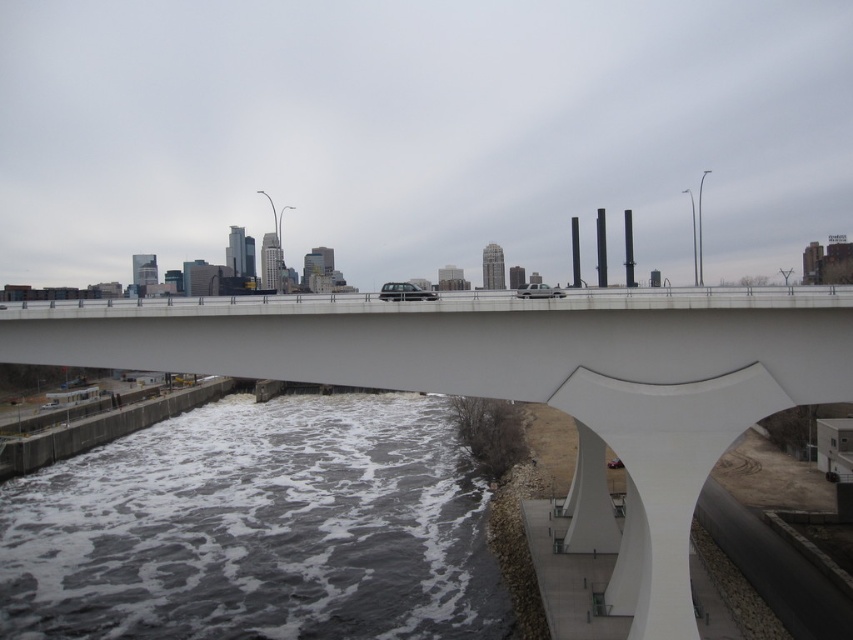
Which is below, white frothy water at lower center or white smooth bridge at center?

Positioned lower is white frothy water at lower center.

Does white frothy water at lower center have a greater height compared to white smooth bridge at center?

In fact, white frothy water at lower center may be shorter than white smooth bridge at center.

This screenshot has height=640, width=853. Identify the location of white frothy water at lower center. (258, 529).